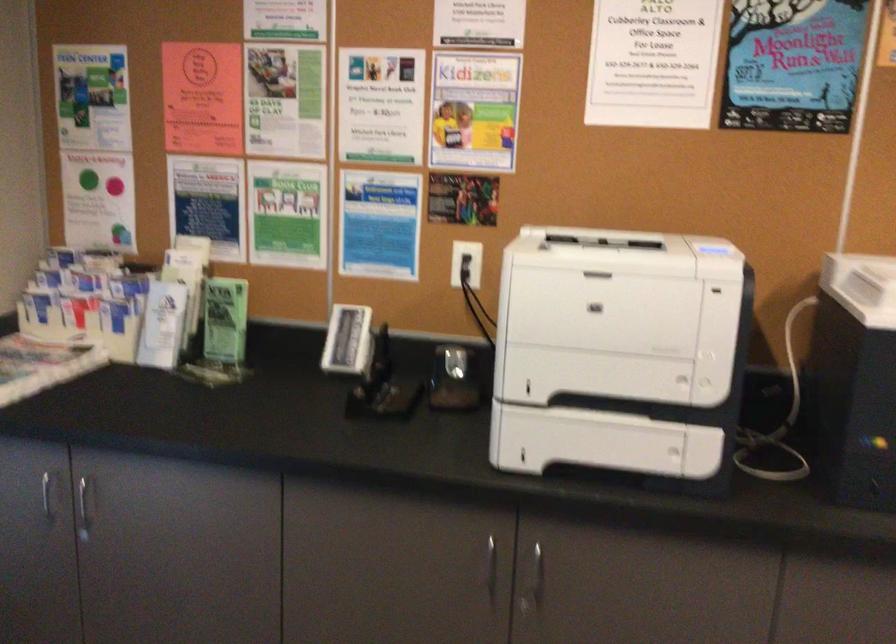
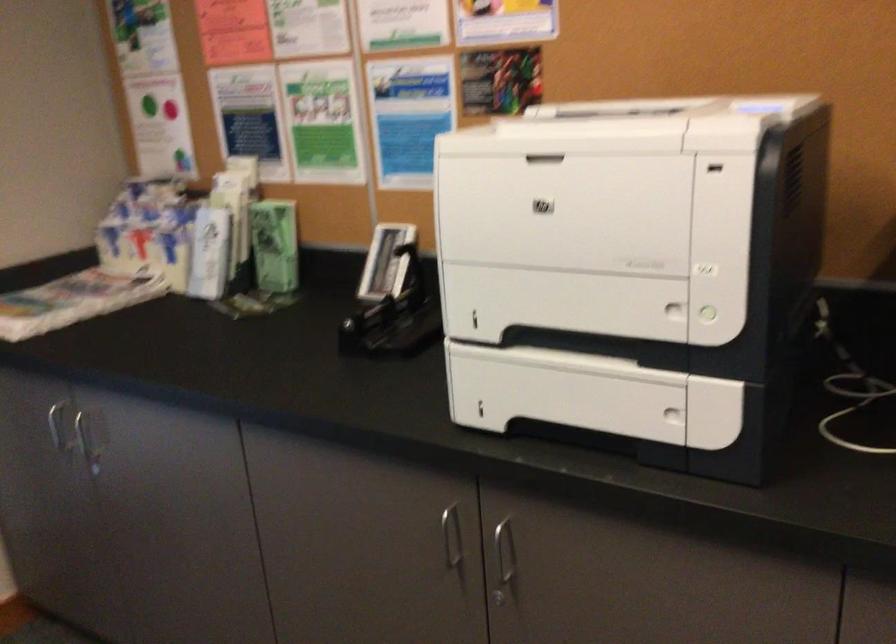
In the second image, find the point that corresponds to pixel 82 502 in the first image.

(89, 440)